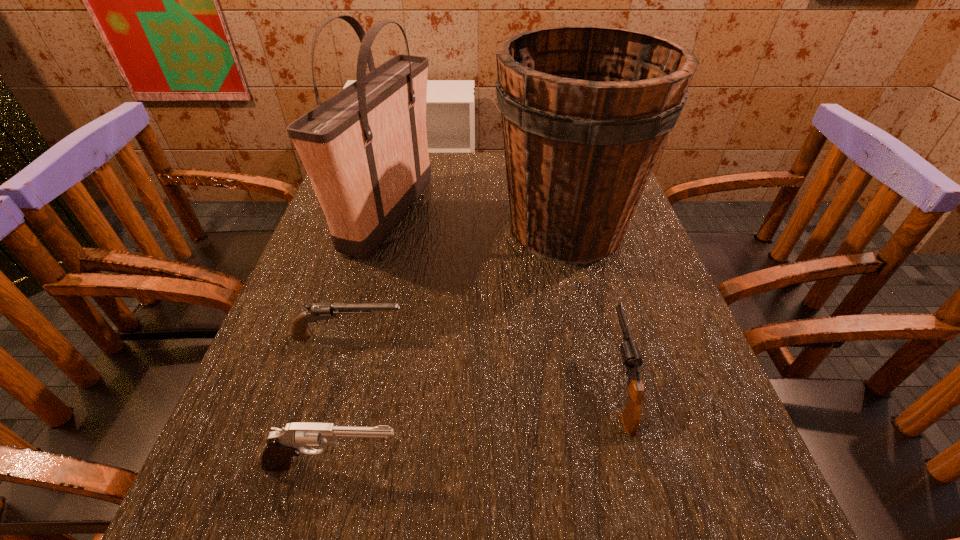
Locate an element on the screen. free space that satisfies the following two spatial constraints: 1. on the front side of the shopping bag; 2. aiming along the barrel of the third nearest object is located at coordinates pos(358,336).